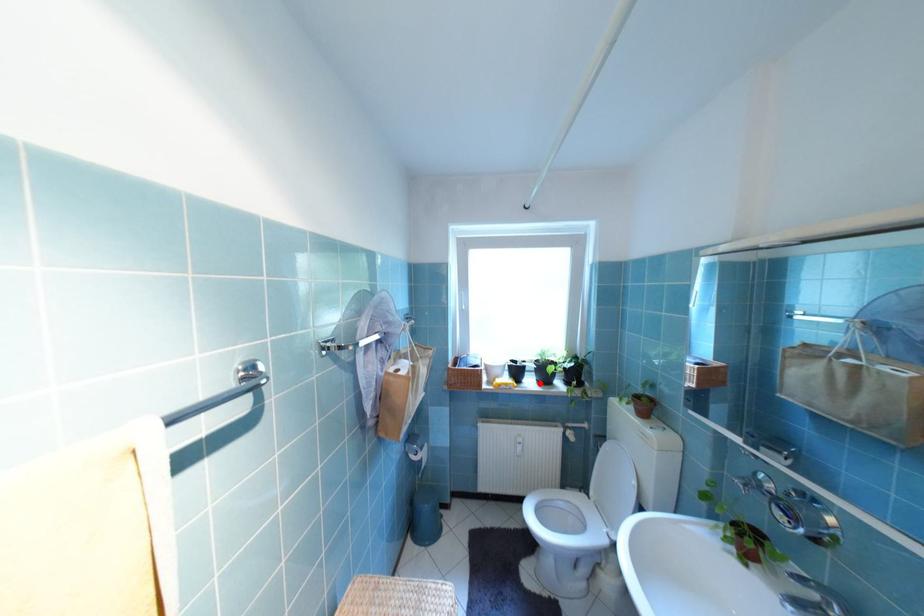
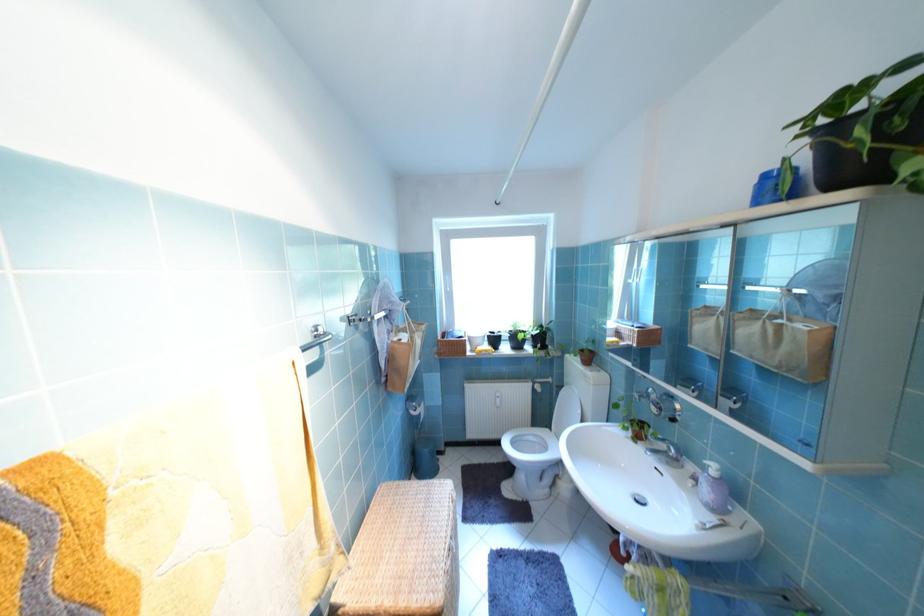
Find the pixel in the second image that matches the highlighted location in the first image.

(515, 349)